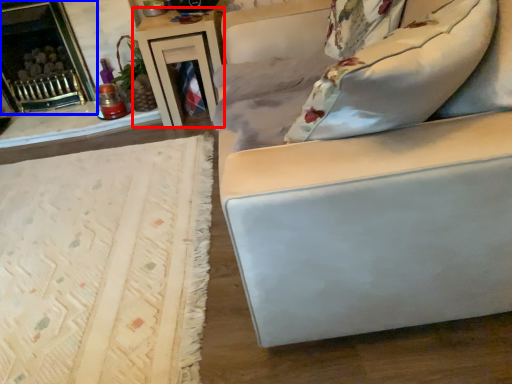
Question: Which object is further to the camera taking this photo, table (highlighted by a red box) or fireplace (highlighted by a blue box)?

Choices:
 (A) table
 (B) fireplace

Answer: (B)